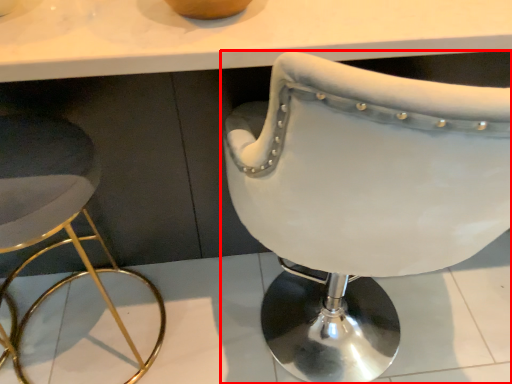
Question: In this image, where is chair (annotated by the red box) located relative to stool?

Choices:
 (A) left
 (B) right

Answer: (B)